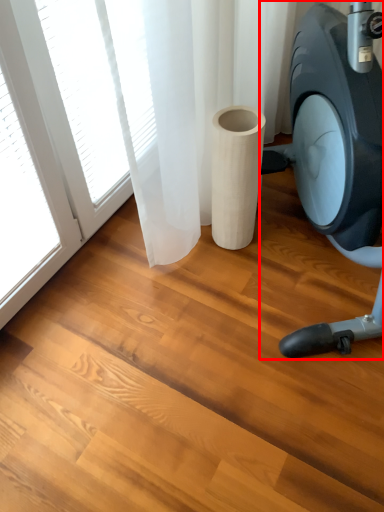
Question: From the image's perspective, where is stationary bicycle (annotated by the red box) located relative to paper towel?

Choices:
 (A) above
 (B) below

Answer: (A)